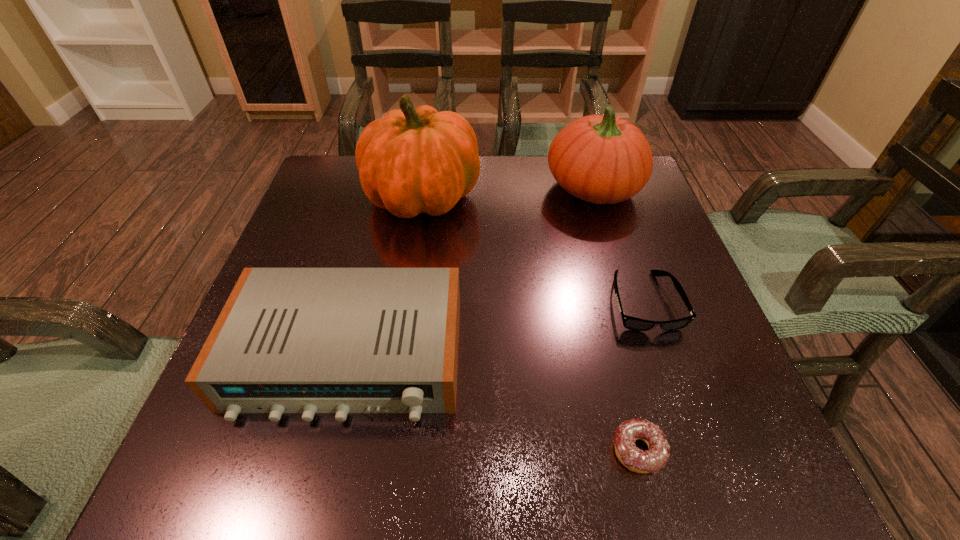
Where is `vacant space located 0.250m on the front-facing side of the sunglasses`? vacant space located 0.250m on the front-facing side of the sunglasses is located at coordinates tap(702, 471).

At what (x,y) coordinates should I click in order to perform the action: click on blank space located on the back of the doughnut. Please return your answer as a coordinate pair (x, y). Looking at the image, I should click on (593, 274).

Locate an element on the screen. The height and width of the screenshot is (540, 960). object located at the near edge is located at coordinates (651, 461).

Find the location of `pumpkin at the left edge`. pumpkin at the left edge is located at coordinates (417, 160).

Locate an element on the screen. radio receiver at the left edge is located at coordinates (288, 340).

This screenshot has width=960, height=540. I want to click on pumpkin that is at the right edge, so click(x=601, y=159).

I want to click on sunglasses present at the right edge, so click(x=632, y=323).

The image size is (960, 540). I want to click on doughnut that is at the right edge, so coord(651,461).

Where is `object positioned at the far left corner`? The height and width of the screenshot is (540, 960). object positioned at the far left corner is located at coordinates (417, 160).

Identify the location of object that is at the far right corner. The width and height of the screenshot is (960, 540). (601, 159).